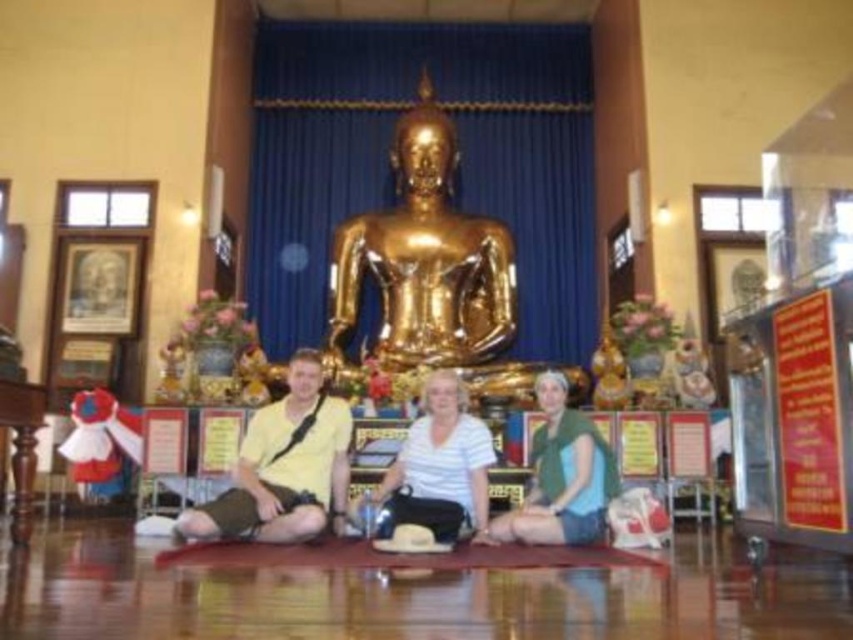
Question: Is gold shiny statue at center bigger than white matte shirt at center?

Choices:
 (A) yes
 (B) no

Answer: (A)

Question: Which point is farther to the camera?

Choices:
 (A) white matte shirt at center
 (B) green matte shirt at center

Answer: (B)

Question: Is gold shiny statue at center to the left of green matte shirt at center from the viewer's perspective?

Choices:
 (A) no
 (B) yes

Answer: (B)

Question: Does yellow matte shirt at center come behind white matte shirt at center?

Choices:
 (A) no
 (B) yes

Answer: (B)

Question: Which object is positioned farthest from the white matte shirt at center?

Choices:
 (A) green matte shirt at center
 (B) yellow matte shirt at center

Answer: (B)

Question: Estimate the real-world distances between objects in this image. Which object is closer to the green matte shirt at center?

Choices:
 (A) gold shiny statue at center
 (B) yellow matte shirt at center

Answer: (B)